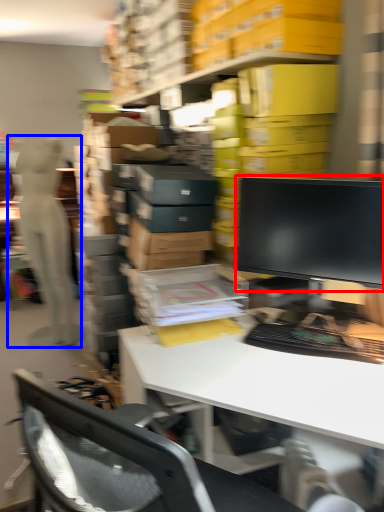
Question: Among these objects, which one is farthest to the camera, computer monitor (highlighted by a red box) or person (highlighted by a blue box)?

Choices:
 (A) computer monitor
 (B) person

Answer: (B)